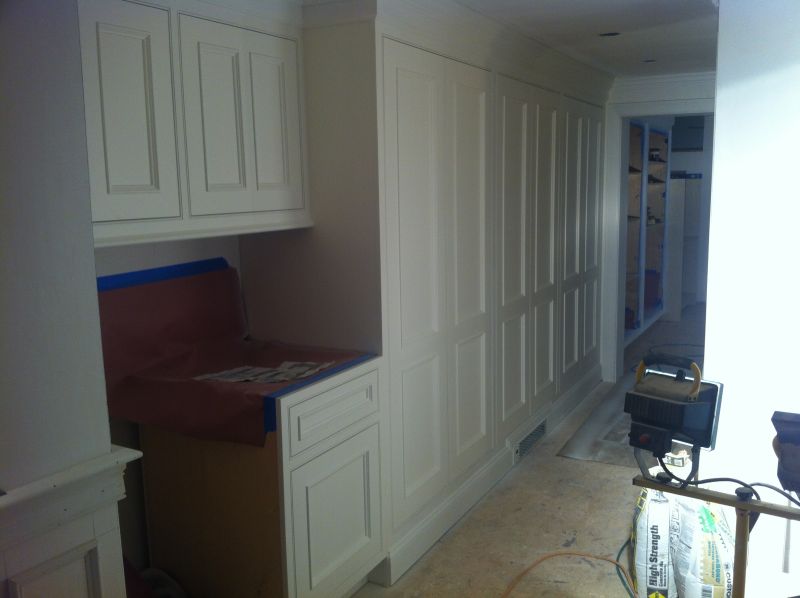
Where is `top of lowercupboard`? The width and height of the screenshot is (800, 598). top of lowercupboard is located at coordinates (244, 350).